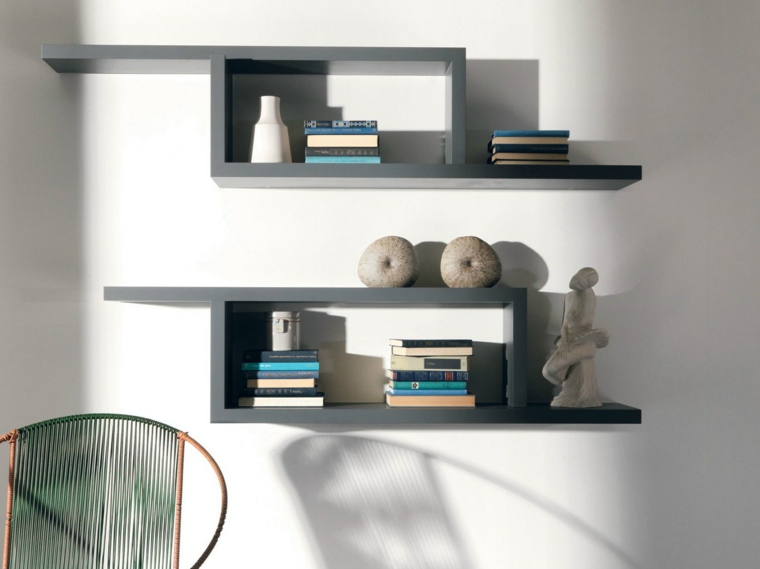
Find the location of a particular element. Image resolution: width=760 pixels, height=569 pixels. decorative object is located at coordinates pyautogui.click(x=394, y=269), pyautogui.click(x=266, y=143), pyautogui.click(x=473, y=271), pyautogui.click(x=584, y=323), pyautogui.click(x=287, y=343).